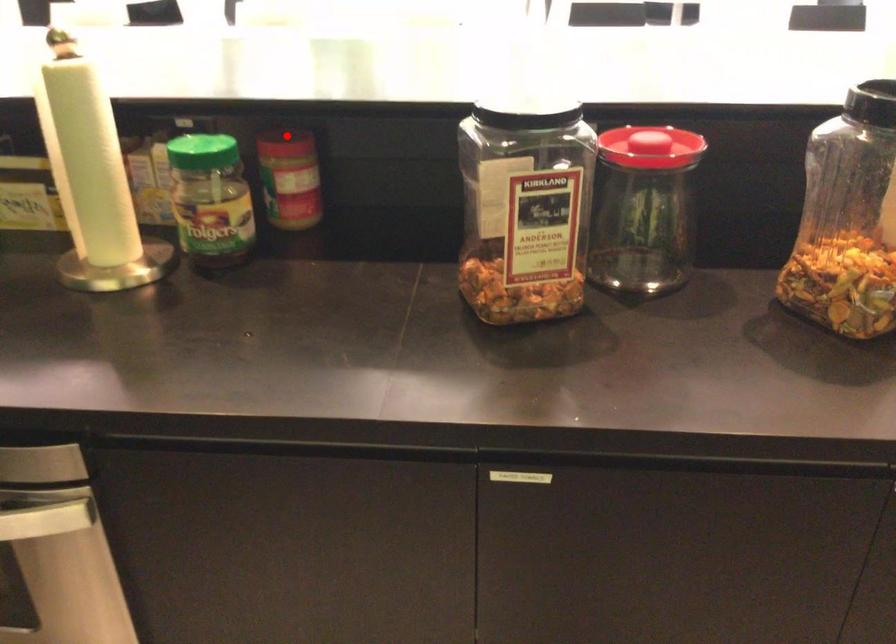
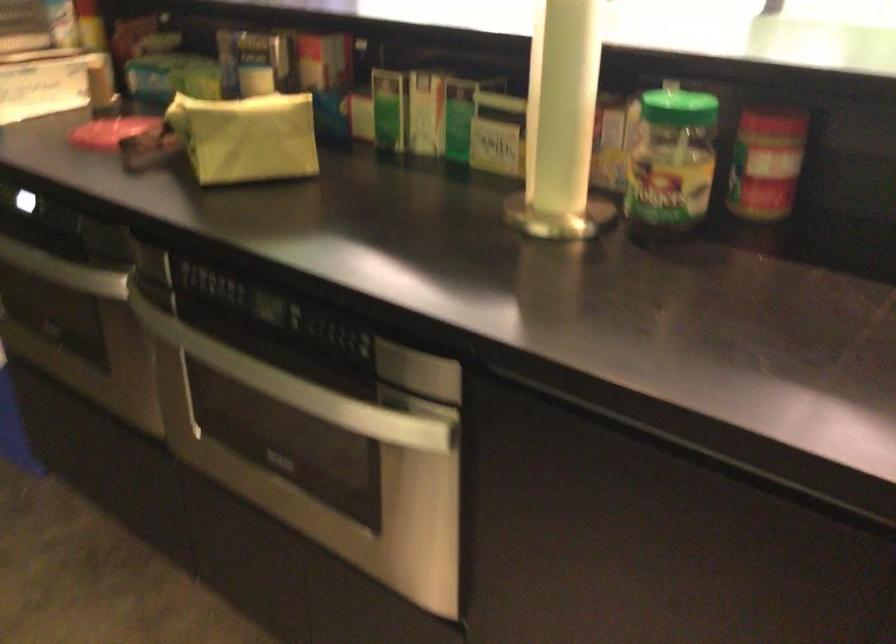
Question: I am providing you with two images of the same scene from different viewpoints. A red point is shown in image1. For the corresponding object point in image2, is it positioned nearer or farther from the camera?

Choices:
 (A) Nearer
 (B) Farther

Answer: (A)